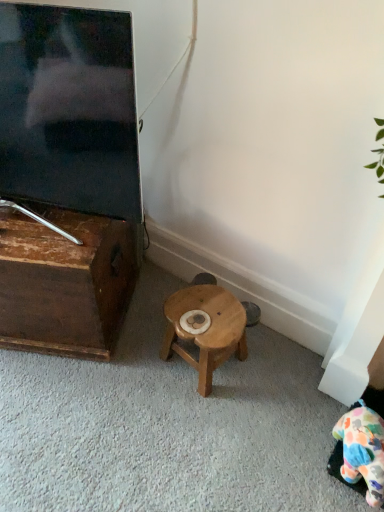
Identify the location of vacant space underneath matte black tv at left (from a real-world perspective). Image resolution: width=384 pixels, height=512 pixels. (56, 226).